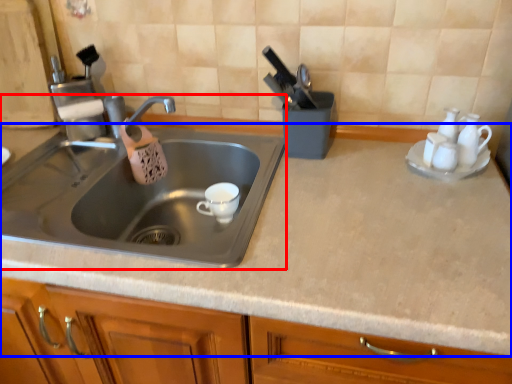
Question: Among these objects, which one is farthest to the camera, sink (highlighted by a red box) or countertop (highlighted by a blue box)?

Choices:
 (A) sink
 (B) countertop

Answer: (A)